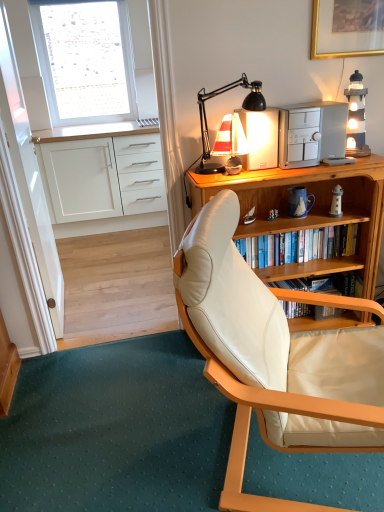
Question: From a real-world perspective, is transparent glass door at left over sailboat-patterned ceramic mug at upper right?

Choices:
 (A) no
 (B) yes

Answer: (B)

Question: From a real-world perspective, is transparent glass door at left positioned under sailboat-patterned ceramic mug at upper right based on gravity?

Choices:
 (A) yes
 (B) no

Answer: (B)

Question: Can you confirm if transparent glass door at left is shorter than sailboat-patterned ceramic mug at upper right?

Choices:
 (A) no
 (B) yes

Answer: (A)

Question: Does transparent glass door at left come behind sailboat-patterned ceramic mug at upper right?

Choices:
 (A) no
 (B) yes

Answer: (A)

Question: Does transparent glass door at left have a greater height compared to sailboat-patterned ceramic mug at upper right?

Choices:
 (A) yes
 (B) no

Answer: (A)

Question: Relative to transparent glass door at left, is wooden desk at center in front or behind?

Choices:
 (A) behind
 (B) front

Answer: (A)

Question: Considering the positions of wooden desk at center and transparent glass door at left in the image, is wooden desk at center bigger or smaller than transparent glass door at left?

Choices:
 (A) big
 (B) small

Answer: (A)

Question: From the image's perspective, is wooden desk at center above or below transparent glass door at left?

Choices:
 (A) below
 (B) above

Answer: (A)

Question: Choose the correct answer: Is wooden desk at center inside transparent glass door at left or outside it?

Choices:
 (A) inside
 (B) outside

Answer: (B)

Question: Would you say white fabric window at upper left is to the left or to the right of sailboat-patterned ceramic mug at upper right in the picture?

Choices:
 (A) right
 (B) left

Answer: (B)

Question: From their relative heights in the image, would you say white fabric window at upper left is taller or shorter than sailboat-patterned ceramic mug at upper right?

Choices:
 (A) tall
 (B) short

Answer: (A)

Question: Does point (79, 5) appear closer or farther from the camera than point (299, 202)?

Choices:
 (A) farther
 (B) closer

Answer: (A)

Question: Is white fabric window at upper left bigger or smaller than sailboat-patterned ceramic mug at upper right?

Choices:
 (A) small
 (B) big

Answer: (B)

Question: Is white matte cabinet at left wider or thinner than beige leather chair at center?

Choices:
 (A) wide
 (B) thin

Answer: (B)

Question: Is white matte cabinet at left bigger or smaller than beige leather chair at center?

Choices:
 (A) big
 (B) small

Answer: (B)